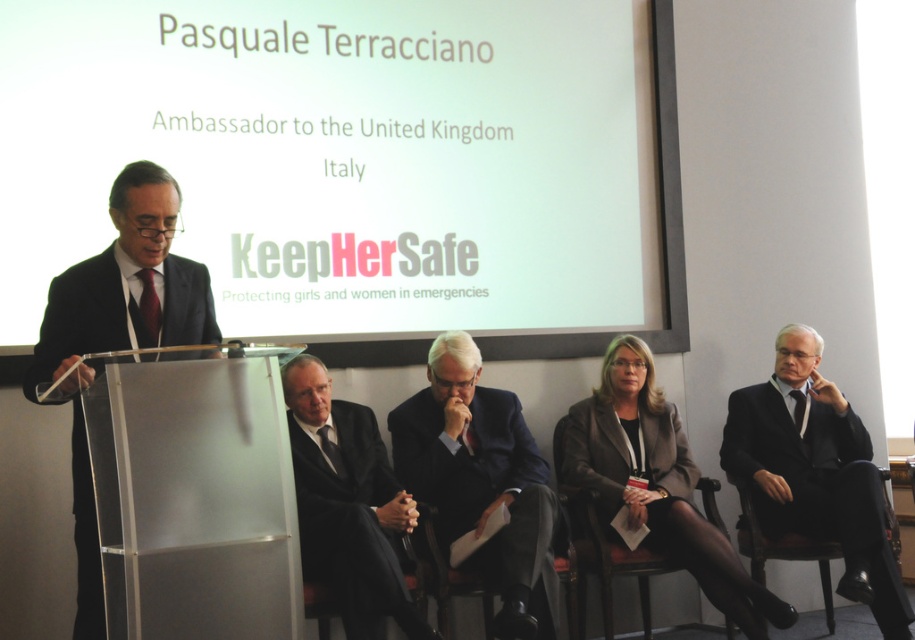
You are organizing a formal event and need to decide which attire to recommend for a guest who prefers a more understated look. Given the presence of the matte gray blazer at center and the black matte suit at center, which one would you suggest?

The black matte suit at center is smaller in size than the matte gray blazer at center, so if the guest prefers a more understated look, the black matte suit at center would be the better choice as it is less imposing in size.

You are standing at the point marked as point (851, 563) and want to reach the podium where the speaker is. The distance between you and the podium is 4.01 meters. If you walk at a speed of 1.5 meters per second, how many seconds will it take you to reach the podium?

It will take approximately 2.67 seconds to reach the podium since 4.01 meters divided by 1.5 meters per second equals approximately 2.67 seconds.